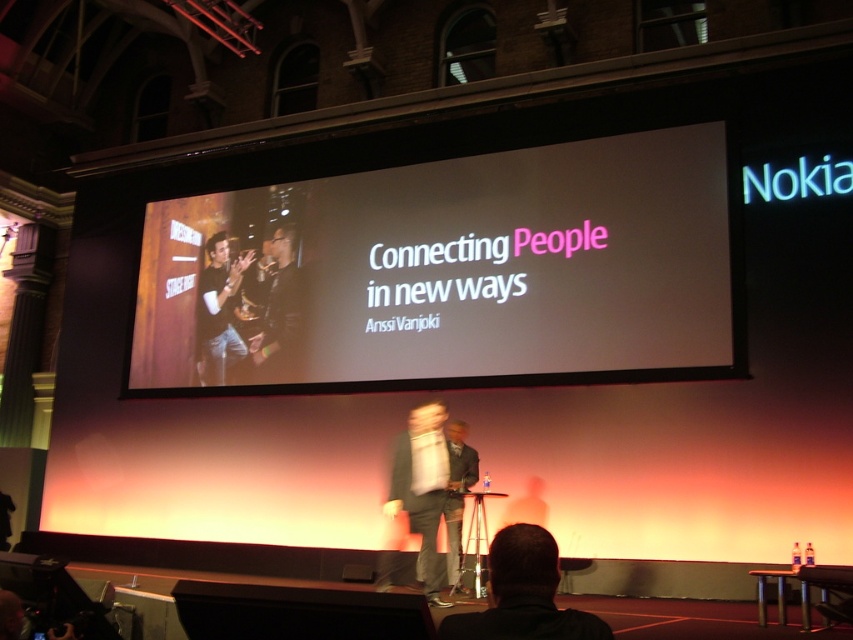
Question: Among these points, which one is nearest to the camera?

Choices:
 (A) (442, 410)
 (B) (361, 576)

Answer: (A)

Question: Does light gray suit at center appear on the left side of matte black shirt at center?

Choices:
 (A) yes
 (B) no

Answer: (B)

Question: Does matte black shirt at center appear over dark gray suit at center?

Choices:
 (A) no
 (B) yes

Answer: (B)

Question: Which point is farther from the camera taking this photo?

Choices:
 (A) (448, 492)
 (B) (225, 353)
 (C) (469, 621)
 (D) (405, 467)

Answer: (B)

Question: Among these objects, which one is farthest from the camera?

Choices:
 (A) dark gray suit at center
 (B) matte black suit at center

Answer: (B)

Question: Does dark gray suit at center appear over matte black suit at center?

Choices:
 (A) no
 (B) yes

Answer: (B)